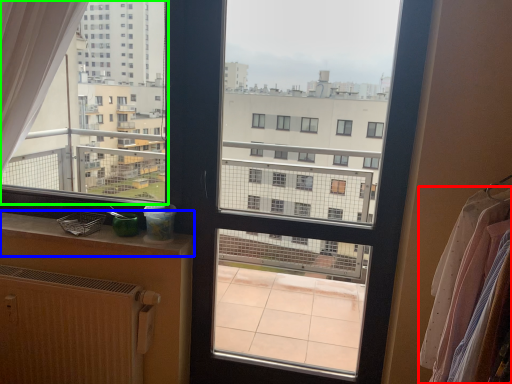
Question: Which object is the farthest from clothing (highlighted by a red box)? Choose among these: window sill (highlighted by a blue box) or condominium (highlighted by a green box).

Choices:
 (A) window sill
 (B) condominium

Answer: (B)